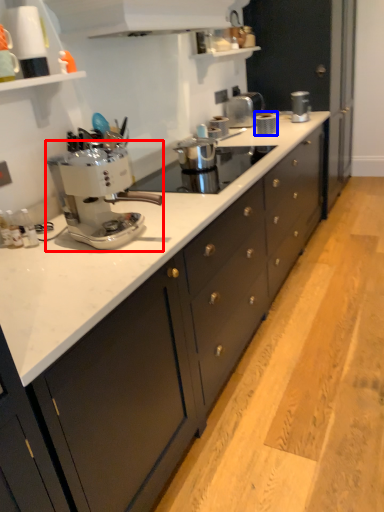
Question: Which object appears farthest to the camera in this image, coffee maker (highlighted by a red box) or kitchen appliance (highlighted by a blue box)?

Choices:
 (A) coffee maker
 (B) kitchen appliance

Answer: (B)